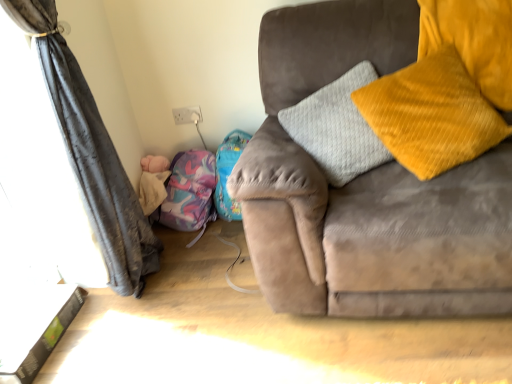
Find the location of a particular element. Image resolution: width=512 pixels, height=384 pixels. vacant area in front of purple fabric bean bag chair at lower left is located at coordinates (201, 242).